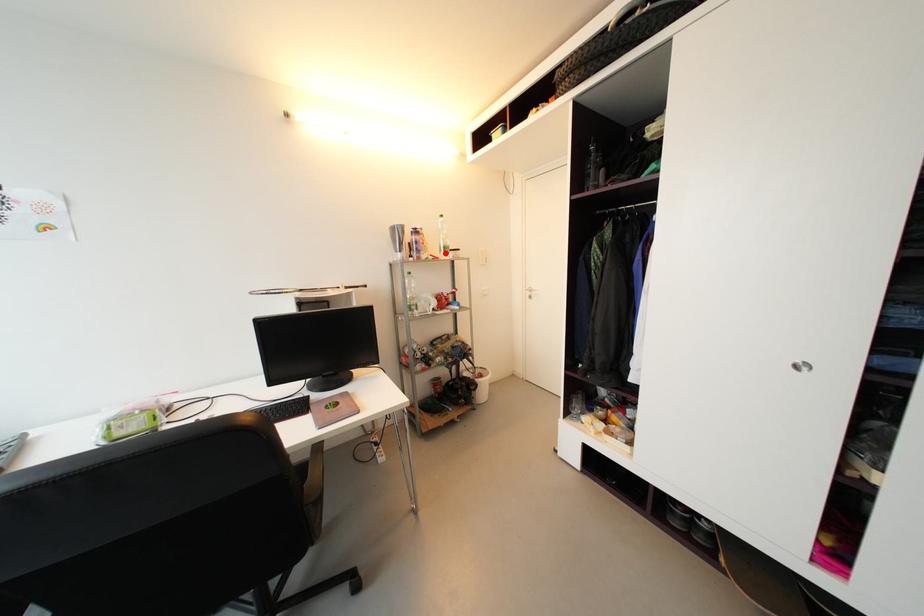
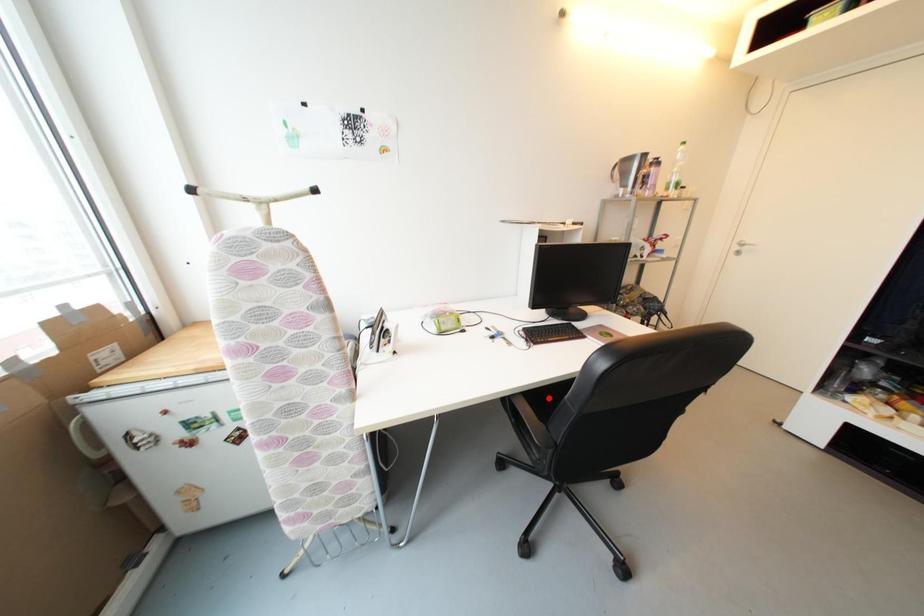
I am providing you with two images of the same scene from different viewpoints. A red point is marked on the first image and another point is marked on the second image. Are the points marked in image1 and image2 representing the same 3D position?

No